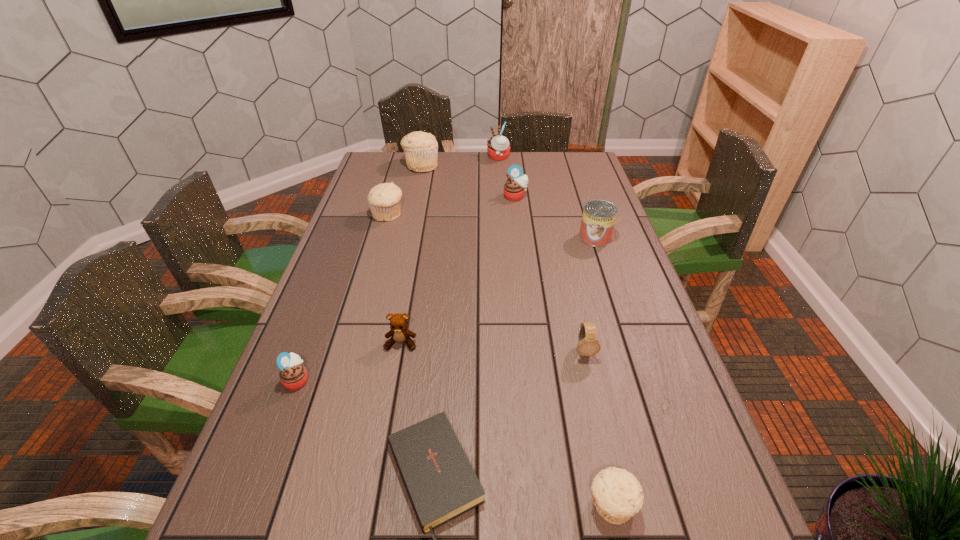
You are a GUI agent. You are given a task and a screenshot of the screen. Output one action in this format:
    pyautogui.click(x=<x>, y=<y>)
    Task: Click on the free region located on the front of the fifth farthest object
    The image size is (960, 540).
    Given the screenshot: What is the action you would take?
    pyautogui.click(x=607, y=274)

Locate an element on the screen. vacant region located 0.330m on the face of the watch is located at coordinates (619, 505).

The height and width of the screenshot is (540, 960). Find the location of `free space located 0.060m on the front-facing side of the teddy bear`. free space located 0.060m on the front-facing side of the teddy bear is located at coordinates (396, 372).

At what (x,y) coordinates should I click in order to perform the action: click on vacant area situated 0.280m on the front-facing side of the third nearest object. Please return your answer as a coordinate pair (x, y). Image resolution: width=960 pixels, height=540 pixels. Looking at the image, I should click on (431, 380).

Where is `vacant region located on the back of the nearest muffin`? vacant region located on the back of the nearest muffin is located at coordinates (592, 420).

Find the location of `object that is at the right edge`. object that is at the right edge is located at coordinates (599, 216).

The image size is (960, 540). Find the location of `object that is at the far left corner`. object that is at the far left corner is located at coordinates (421, 149).

The image size is (960, 540). Find the location of `vacant space at the far edge of the desktop`. vacant space at the far edge of the desktop is located at coordinates (408, 172).

The height and width of the screenshot is (540, 960). Find the location of `blank space at the left edge`. blank space at the left edge is located at coordinates (340, 351).

Locate an element on the screen. The image size is (960, 540). vacant space at the right edge is located at coordinates (637, 457).